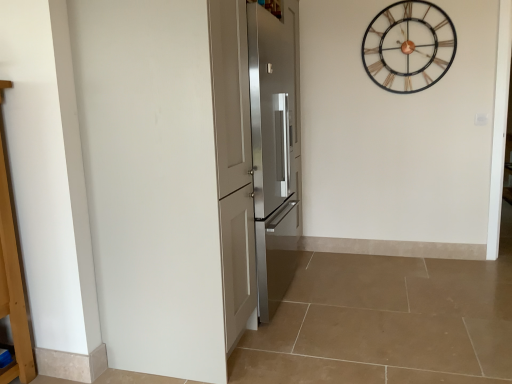
Where is `metallic wireframe clock at upper right`? The height and width of the screenshot is (384, 512). metallic wireframe clock at upper right is located at coordinates (409, 46).

Describe the element at coordinates (274, 143) in the screenshot. The width and height of the screenshot is (512, 384). I see `stainless steel refrigerator at center, the first door in the back-to-front sequence` at that location.

I want to click on satin silver refrigerator at center, the second door in the back-to-front sequence, so click(151, 182).

You are a GUI agent. You are given a task and a screenshot of the screen. Output one action in this format:
    pyautogui.click(x=<x>, y=<y>)
    Task: Click on the metallic wireframe clock at upper right
    This screenshot has width=512, height=384.
    Given the screenshot: What is the action you would take?
    pyautogui.click(x=409, y=46)

Is satin silver refrigerator at center, the 1th door positioned from the front, directly adjacent to stainless steel refrigerator at center, the first door in the back-to-front sequence?

No, satin silver refrigerator at center, the 1th door positioned from the front, is not in contact with stainless steel refrigerator at center, the first door in the back-to-front sequence.

Considering the positions of objects satin silver refrigerator at center, the 1th door positioned from the front, and stainless steel refrigerator at center, marked as the 2th door in a front-to-back arrangement, in the image provided, who is more to the right, satin silver refrigerator at center, the 1th door positioned from the front, or stainless steel refrigerator at center, marked as the 2th door in a front-to-back arrangement,?

stainless steel refrigerator at center, marked as the 2th door in a front-to-back arrangement, is more to the right.

From the image's perspective, is satin silver refrigerator at center, the second door in the back-to-front sequence, on top of stainless steel refrigerator at center, the first door in the back-to-front sequence?

Yes, from the image's perspective, satin silver refrigerator at center, the second door in the back-to-front sequence, is over stainless steel refrigerator at center, the first door in the back-to-front sequence.

Between point (174, 69) and point (277, 273), which one is positioned in front?

The point (174, 69) is more forward.

Considering the sizes of stainless steel refrigerator at center, the first door in the back-to-front sequence, and metallic wireframe clock at upper right in the image, is stainless steel refrigerator at center, the first door in the back-to-front sequence, bigger or smaller than metallic wireframe clock at upper right?

Considering their sizes, stainless steel refrigerator at center, the first door in the back-to-front sequence, takes up more space than metallic wireframe clock at upper right.

Considering the sizes of stainless steel refrigerator at center, marked as the 2th door in a front-to-back arrangement, and metallic wireframe clock at upper right in the image, is stainless steel refrigerator at center, marked as the 2th door in a front-to-back arrangement, taller or shorter than metallic wireframe clock at upper right?

Considering their sizes, stainless steel refrigerator at center, marked as the 2th door in a front-to-back arrangement, has more height than metallic wireframe clock at upper right.

Can metallic wireframe clock at upper right be found inside stainless steel refrigerator at center, marked as the 2th door in a front-to-back arrangement?

No, stainless steel refrigerator at center, marked as the 2th door in a front-to-back arrangement, does not contain metallic wireframe clock at upper right.

Between stainless steel refrigerator at center, the first door in the back-to-front sequence, and metallic wireframe clock at upper right, which one has larger width?

stainless steel refrigerator at center, the first door in the back-to-front sequence, is wider.

Would you say stainless steel refrigerator at center, marked as the 2th door in a front-to-back arrangement, contains satin silver refrigerator at center, the 1th door positioned from the front?

No.

Is point (284, 4) closer or farther from the camera than point (152, 297)?

Point (284, 4) appears to be farther away from the viewer than point (152, 297).

Find the location of a particular element. The width and height of the screenshot is (512, 384). door above the stainless steel refrigerator at center, marked as the 2th door in a front-to-back arrangement (from the image's perspective) is located at coordinates (151, 182).

Does stainless steel refrigerator at center, marked as the 2th door in a front-to-back arrangement, have a larger size compared to satin silver refrigerator at center, the 1th door positioned from the front?

Incorrect, stainless steel refrigerator at center, marked as the 2th door in a front-to-back arrangement, is not larger than satin silver refrigerator at center, the 1th door positioned from the front.

Considering the sizes of objects metallic wireframe clock at upper right and satin silver refrigerator at center, the 1th door positioned from the front, in the image provided, who is bigger, metallic wireframe clock at upper right or satin silver refrigerator at center, the 1th door positioned from the front,?

With larger size is satin silver refrigerator at center, the 1th door positioned from the front.

Identify the location of wall clock on the right of satin silver refrigerator at center, the second door in the back-to-front sequence. Image resolution: width=512 pixels, height=384 pixels. coord(409,46).

Is metallic wireframe clock at upper right placed right next to satin silver refrigerator at center, the 1th door positioned from the front?

No, metallic wireframe clock at upper right is not beside satin silver refrigerator at center, the 1th door positioned from the front.

Can you confirm if satin silver refrigerator at center, the 1th door positioned from the front, is positioned to the right of metallic wireframe clock at upper right?

In fact, satin silver refrigerator at center, the 1th door positioned from the front, is to the left of metallic wireframe clock at upper right.

Considering their positions, is satin silver refrigerator at center, the 1th door positioned from the front, located in front of or behind metallic wireframe clock at upper right?

Clearly, satin silver refrigerator at center, the 1th door positioned from the front, is in front of metallic wireframe clock at upper right.

Is satin silver refrigerator at center, the second door in the back-to-front sequence, looking in the opposite direction of metallic wireframe clock at upper right?

satin silver refrigerator at center, the second door in the back-to-front sequence, is not turned away from metallic wireframe clock at upper right.

From the image's perspective, which is above, satin silver refrigerator at center, the 1th door positioned from the front, or metallic wireframe clock at upper right?

metallic wireframe clock at upper right.

Based on the photo, is metallic wireframe clock at upper right inside the boundaries of stainless steel refrigerator at center, marked as the 2th door in a front-to-back arrangement, or outside?

metallic wireframe clock at upper right exists outside the volume of stainless steel refrigerator at center, marked as the 2th door in a front-to-back arrangement.

Is metallic wireframe clock at upper right facing towards stainless steel refrigerator at center, marked as the 2th door in a front-to-back arrangement?

No, metallic wireframe clock at upper right is not facing towards stainless steel refrigerator at center, marked as the 2th door in a front-to-back arrangement.

From the image's perspective, is metallic wireframe clock at upper right above or below stainless steel refrigerator at center, the first door in the back-to-front sequence?

metallic wireframe clock at upper right is above stainless steel refrigerator at center, the first door in the back-to-front sequence.

At what (x,y) coordinates should I click in order to perform the action: click on door that is in front of the stainless steel refrigerator at center, marked as the 2th door in a front-to-back arrangement. Please return your answer as a coordinate pair (x, y). Looking at the image, I should click on (151, 182).

Where is `door that is the 1st one when counting leftward from the metallic wireframe clock at upper right`? The image size is (512, 384). door that is the 1st one when counting leftward from the metallic wireframe clock at upper right is located at coordinates (274, 143).

Estimate the real-world distances between objects in this image. Which object is closer to satin silver refrigerator at center, the 1th door positioned from the front, metallic wireframe clock at upper right or stainless steel refrigerator at center, marked as the 2th door in a front-to-back arrangement?

stainless steel refrigerator at center, marked as the 2th door in a front-to-back arrangement, is positioned closer to the anchor satin silver refrigerator at center, the 1th door positioned from the front.

Looking at the image, which one is located further to stainless steel refrigerator at center, marked as the 2th door in a front-to-back arrangement, metallic wireframe clock at upper right or satin silver refrigerator at center, the 1th door positioned from the front?

metallic wireframe clock at upper right.

When comparing their distances from metallic wireframe clock at upper right, does satin silver refrigerator at center, the 1th door positioned from the front, or stainless steel refrigerator at center, the first door in the back-to-front sequence, seem further?

Among the two, satin silver refrigerator at center, the 1th door positioned from the front, is located further to metallic wireframe clock at upper right.

Estimate the real-world distances between objects in this image. Which object is further from stainless steel refrigerator at center, the first door in the back-to-front sequence, satin silver refrigerator at center, the second door in the back-to-front sequence, or metallic wireframe clock at upper right?

metallic wireframe clock at upper right is further to stainless steel refrigerator at center, the first door in the back-to-front sequence.

Looking at the image, which one is located closer to satin silver refrigerator at center, the 1th door positioned from the front, stainless steel refrigerator at center, the first door in the back-to-front sequence, or metallic wireframe clock at upper right?

Among the two, stainless steel refrigerator at center, the first door in the back-to-front sequence, is located nearer to satin silver refrigerator at center, the 1th door positioned from the front.

Estimate the real-world distances between objects in this image. Which object is closer to metallic wireframe clock at upper right, stainless steel refrigerator at center, the first door in the back-to-front sequence, or satin silver refrigerator at center, the 1th door positioned from the front?

The object closer to metallic wireframe clock at upper right is stainless steel refrigerator at center, the first door in the back-to-front sequence.

This screenshot has height=384, width=512. Find the location of `door between satin silver refrigerator at center, the 1th door positioned from the front, and metallic wireframe clock at upper right in the front-back direction`. door between satin silver refrigerator at center, the 1th door positioned from the front, and metallic wireframe clock at upper right in the front-back direction is located at coordinates (274, 143).